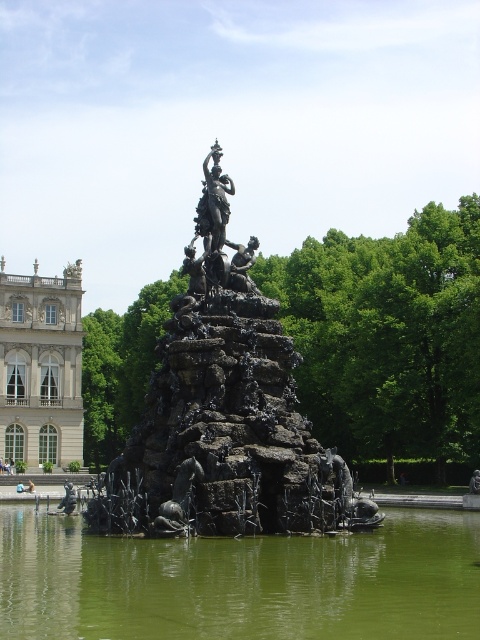
Looking at this image, is black metal fountain at center above bronze statue at center?

Incorrect, black metal fountain at center is not positioned above bronze statue at center.

This screenshot has height=640, width=480. What do you see at coordinates (225, 429) in the screenshot? I see `black metal fountain at center` at bounding box center [225, 429].

Between point (291, 358) and point (256, 237), which one is positioned in front?

Positioned in front is point (291, 358).

In order to click on black metal fountain at center in this screenshot , I will do `click(225, 429)`.

Is polished bronze statue at center positioned at the back of bronze statue at center?

Yes, polished bronze statue at center is behind bronze statue at center.

Does polished bronze statue at center appear under bronze statue at center?

Actually, polished bronze statue at center is above bronze statue at center.

Is point (193, 218) in front of point (245, 289)?

That is False.

Find the location of a particular element. polished bronze statue at center is located at coordinates (214, 202).

Consider the image. Who is shorter, white marble palace at left or bronze statue at center?

bronze statue at center

Which is more to the left, white marble palace at left or bronze statue at center?

white marble palace at left

Locate an element on the screen. white marble palace at left is located at coordinates (40, 365).